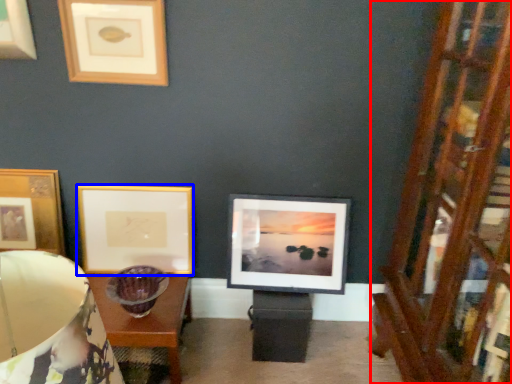
Question: Which of the following is the closest to the observer, dresser (highlighted by a red box) or picture frame (highlighted by a blue box)?

Choices:
 (A) dresser
 (B) picture frame

Answer: (A)